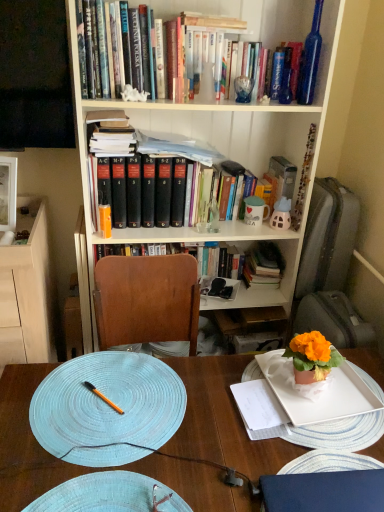
Find the location of `free location in front of orange glossy pen at center`. free location in front of orange glossy pen at center is located at coordinates pyautogui.click(x=92, y=454).